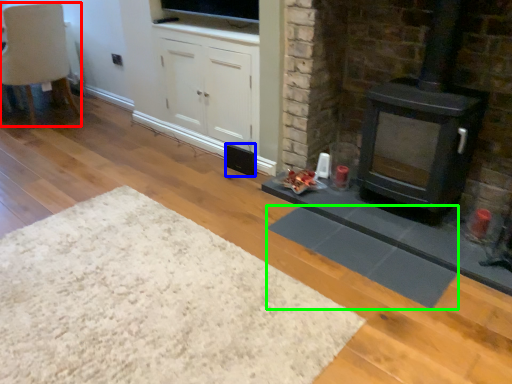
Question: Which is farther away from chair (highlighted by a red box)? speaker (highlighted by a blue box) or mat (highlighted by a green box)?

Choices:
 (A) speaker
 (B) mat

Answer: (B)